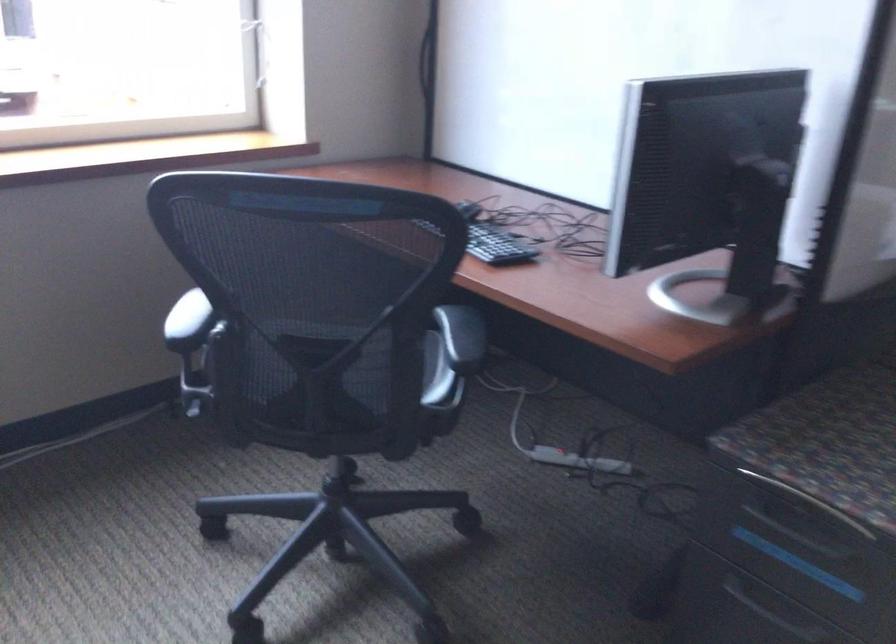
What are the coordinates of `power strip switch` in the screenshot? It's located at (560, 456).